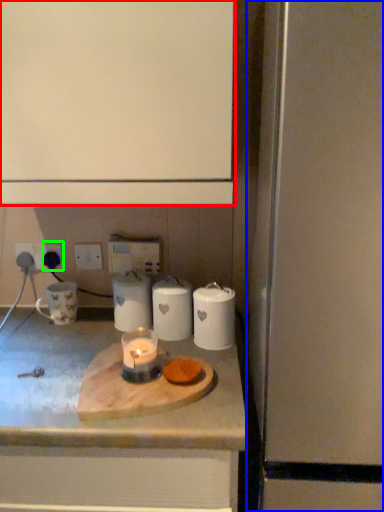
Question: Which object is positioned closest to cabinetry (highlighted by a red box)? Select from appliance (highlighted by a blue box) and electric outlet (highlighted by a green box).

Choices:
 (A) appliance
 (B) electric outlet

Answer: (A)